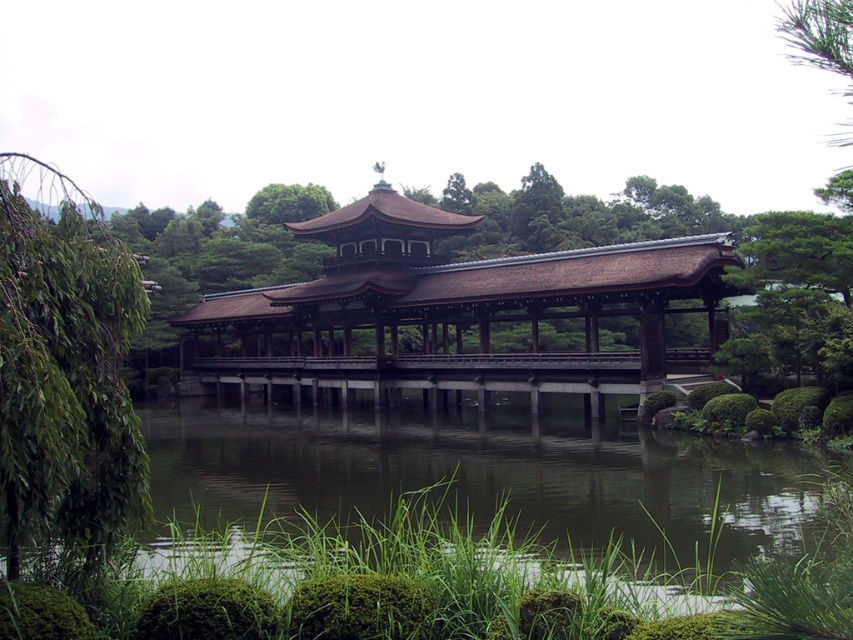
Question: Among these points, which one is farthest from the camera?

Choices:
 (A) (460, 390)
 (B) (701, 381)

Answer: (A)

Question: Which object appears closest to the camera in this image?

Choices:
 (A) green leafy tree at left
 (B) brown wooden bridge at center
 (C) brown wooden gazebo at center

Answer: (A)

Question: Is brown wooden gazebo at center further to camera compared to green leafy tree at left?

Choices:
 (A) yes
 (B) no

Answer: (A)

Question: Does brown wooden gazebo at center have a greater width compared to green leafy tree at left?

Choices:
 (A) yes
 (B) no

Answer: (A)

Question: Which point is closer to the camera?

Choices:
 (A) brown wooden bridge at center
 (B) green leafy tree at left
 (C) brown wooden gazebo at center

Answer: (B)

Question: Can you confirm if brown wooden gazebo at center is positioned to the left of brown wooden bridge at center?

Choices:
 (A) yes
 (B) no

Answer: (B)